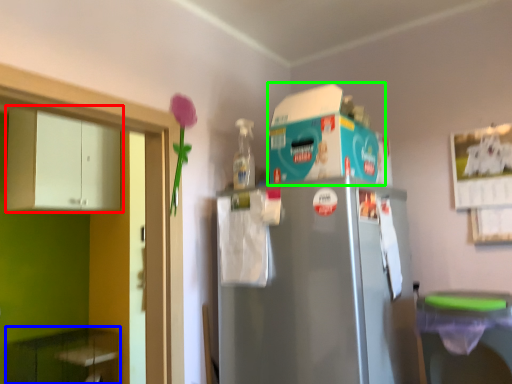
Question: Considering the real-world distances, which object is farthest from cabinetry (highlighted by a red box)? cabinetry (highlighted by a blue box) or appliance (highlighted by a green box)?

Choices:
 (A) cabinetry
 (B) appliance

Answer: (B)